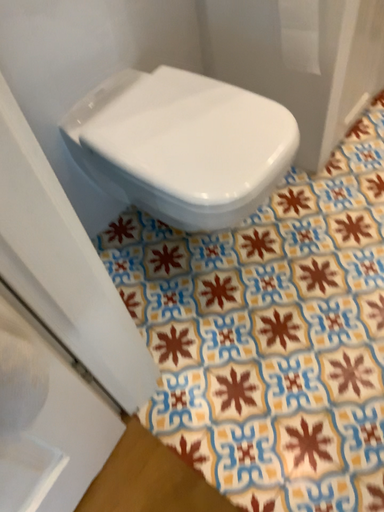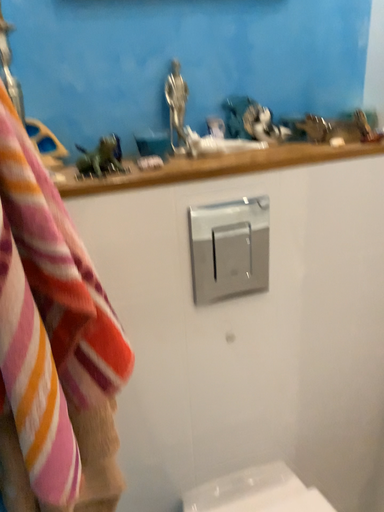
Question: Which way did the camera rotate in the video?

Choices:
 (A) rotated downward
 (B) rotated upward

Answer: (B)